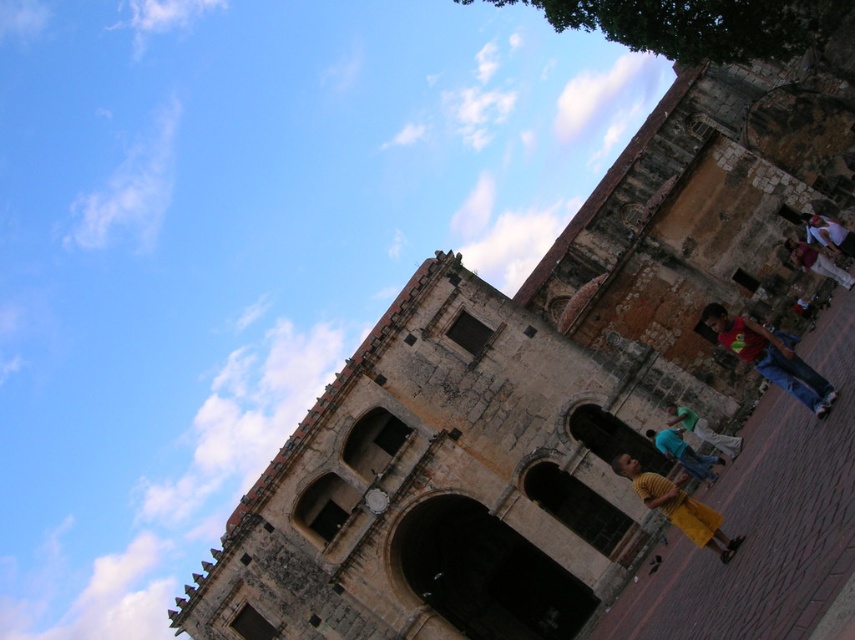
You are a photographer trying to capture a shot of the historic stone building. You notice two items in the foreground that might obstruct your view. The yellow matte skirt at lower right and the light brown leather jacket at right. Which one is closer to the left side of your frame?

The yellow matte skirt at lower right is to the left of the light brown leather jacket at right, so it is closer to the left side of the frame.